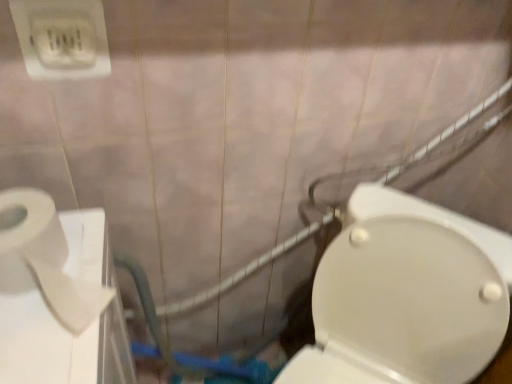
Question: Should I look upward or downward to see white plastic outlet at upper left?

Choices:
 (A) down
 (B) up

Answer: (B)

Question: Considering the relative positions of white glossy toilet at center right and white plastic outlet at upper left in the image provided, is white glossy toilet at center right in front of white plastic outlet at upper left?

Choices:
 (A) no
 (B) yes

Answer: (B)

Question: Would you say white plastic outlet at upper left is part of white glossy toilet at center right's contents?

Choices:
 (A) no
 (B) yes

Answer: (A)

Question: Considering the relative sizes of white glossy toilet at center right and white plastic outlet at upper left in the image provided, is white glossy toilet at center right shorter than white plastic outlet at upper left?

Choices:
 (A) no
 (B) yes

Answer: (A)

Question: From a real-world perspective, is white glossy toilet at center right on white plastic outlet at upper left?

Choices:
 (A) no
 (B) yes

Answer: (A)

Question: Does white glossy toilet at center right appear on the right side of white plastic outlet at upper left?

Choices:
 (A) yes
 (B) no

Answer: (A)

Question: Is white glossy toilet at center right wider than white plastic outlet at upper left?

Choices:
 (A) no
 (B) yes

Answer: (B)

Question: Would you say white plastic outlet at upper left is outside white glossy toilet at center right?

Choices:
 (A) no
 (B) yes

Answer: (B)

Question: From the image's perspective, is white plastic outlet at upper left under white glossy toilet at center right?

Choices:
 (A) yes
 (B) no

Answer: (B)

Question: Is white plastic outlet at upper left positioned behind white glossy toilet at center right?

Choices:
 (A) yes
 (B) no

Answer: (A)

Question: Is white plastic outlet at upper left to the left of white glossy toilet at center right from the viewer's perspective?

Choices:
 (A) yes
 (B) no

Answer: (A)

Question: Are white plastic outlet at upper left and white glossy toilet at center right making contact?

Choices:
 (A) yes
 (B) no

Answer: (B)

Question: Is white plastic outlet at upper left facing away from white glossy toilet at center right?

Choices:
 (A) no
 (B) yes

Answer: (A)

Question: Is white glossy toilet at center right looking in the opposite direction of white matte toilet paper at left?

Choices:
 (A) yes
 (B) no

Answer: (B)